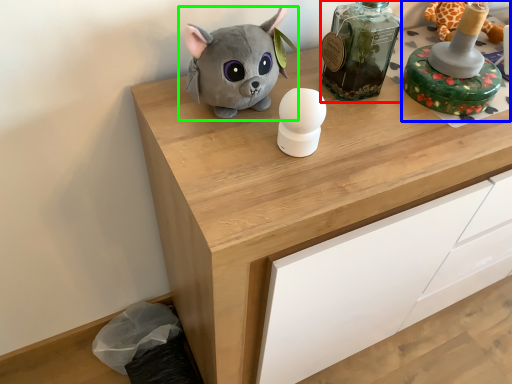
Question: Based on their relative distances, which object is farther from bottle (highlighted by a red box)? Choose from toy (highlighted by a blue box) and toy (highlighted by a green box).

Choices:
 (A) toy
 (B) toy

Answer: (B)